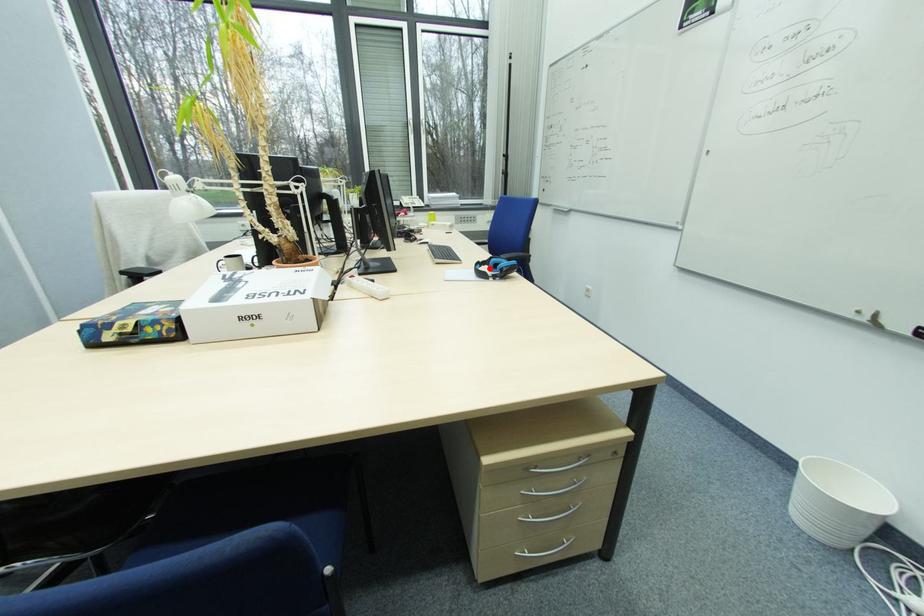
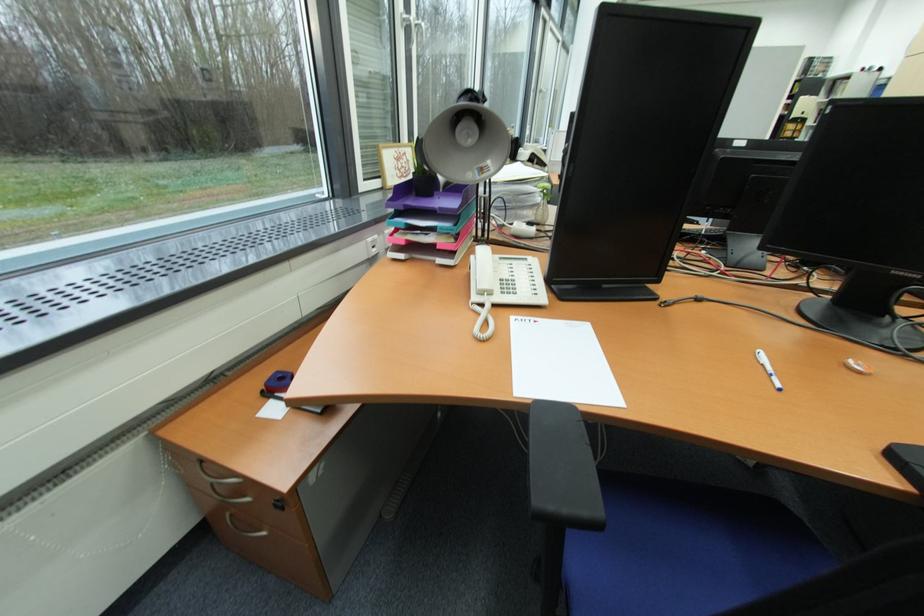
Question: I am providing you with two images of the same scene from different viewpoints. A red point is marked on the first image. Can you still see the location of the red point in image 2?

Choices:
 (A) Yes
 (B) No

Answer: (B)